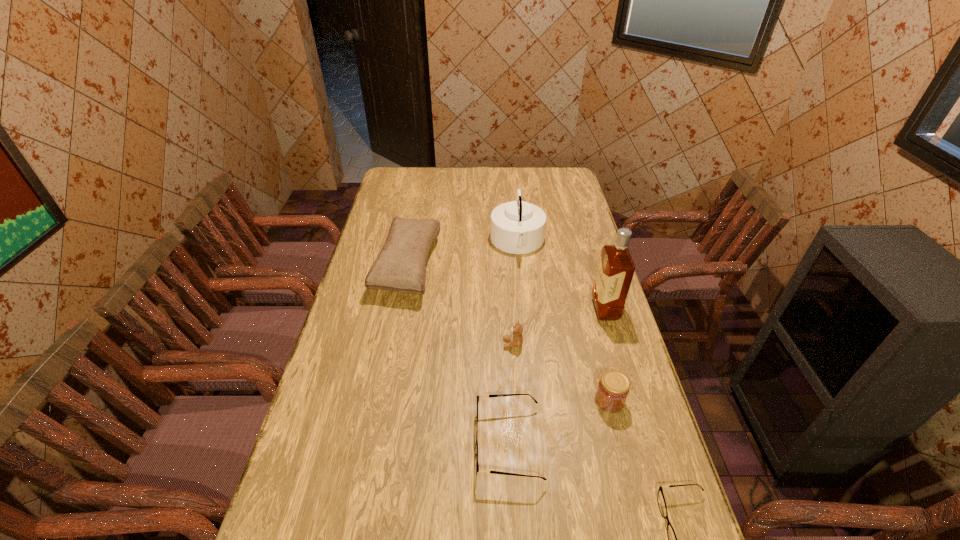
Image resolution: width=960 pixels, height=540 pixels. Find the location of `vacant space positioned 0.140m on the front-facing side of the fourth farthest object`. vacant space positioned 0.140m on the front-facing side of the fourth farthest object is located at coordinates (459, 343).

Where is `free space located 0.360m on the front-facing side of the fourth farthest object`? The image size is (960, 540). free space located 0.360m on the front-facing side of the fourth farthest object is located at coordinates (390, 343).

At what (x,y) coordinates should I click in order to perform the action: click on object that is at the left edge. Please return your answer as a coordinate pair (x, y). The width and height of the screenshot is (960, 540). Looking at the image, I should click on (400, 266).

Image resolution: width=960 pixels, height=540 pixels. I want to click on jam situated at the right edge, so click(x=613, y=388).

The image size is (960, 540). In order to click on liquor that is at the right edge in this screenshot , I will do `click(616, 268)`.

In the image, there is a desktop. Where is `blank space at the far edge`? Image resolution: width=960 pixels, height=540 pixels. blank space at the far edge is located at coordinates [x=470, y=175].

The image size is (960, 540). In the image, there is a desktop. Identify the location of vacant area at the near edge. (486, 538).

The width and height of the screenshot is (960, 540). Find the location of `free spot at the right edge of the desktop`. free spot at the right edge of the desktop is located at coordinates (596, 265).

Identify the location of vacant area at the far left corner. Image resolution: width=960 pixels, height=540 pixels. (417, 170).

Find the location of a particular element. This screenshot has width=960, height=540. empty space between the jam and the tallest object is located at coordinates (608, 355).